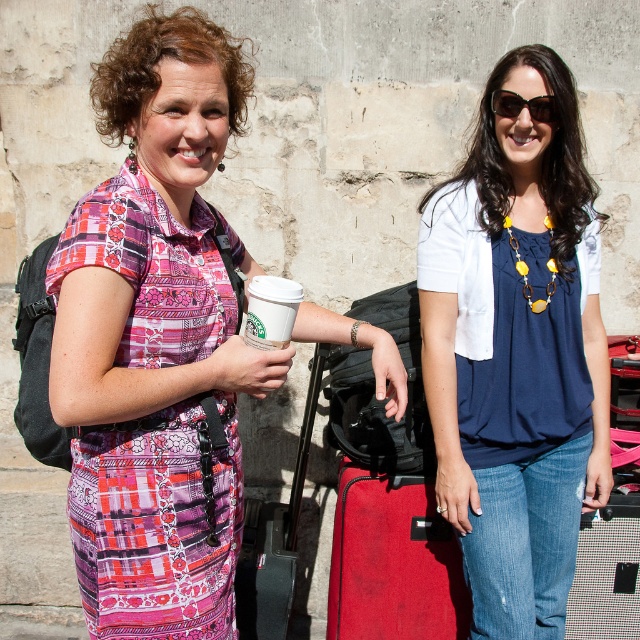
Does navy blue fabric shirt at center appear over white paper cup at center?

Incorrect, navy blue fabric shirt at center is not positioned above white paper cup at center.

Is navy blue fabric shirt at center bigger than white paper cup at center?

Correct, navy blue fabric shirt at center is larger in size than white paper cup at center.

Between point (573, 112) and point (264, 312), which one is positioned behind?

The point (573, 112) is behind.

Where is `navy blue fabric shirt at center`? navy blue fabric shirt at center is located at coordinates (516, 353).

Does matte black suitcase at center appear under white paper cup at center?

Correct, matte black suitcase at center is located below white paper cup at center.

Does matte black suitcase at center appear on the left side of white paper cup at center?

Correct, you'll find matte black suitcase at center to the left of white paper cup at center.

Is point (284, 540) in front of point (291, 282)?

No, it is not.

Locate an element on the screen. This screenshot has height=640, width=640. matte black suitcase at center is located at coordinates (275, 538).

Between point (163, 564) and point (513, 93), which one is positioned behind?

The point (513, 93) is behind.

From the picture: Is matte pink dress at center to the right of sunglasses at upper center from the viewer's perspective?

In fact, matte pink dress at center is to the left of sunglasses at upper center.

Locate an element on the screen. matte pink dress at center is located at coordinates (156, 340).